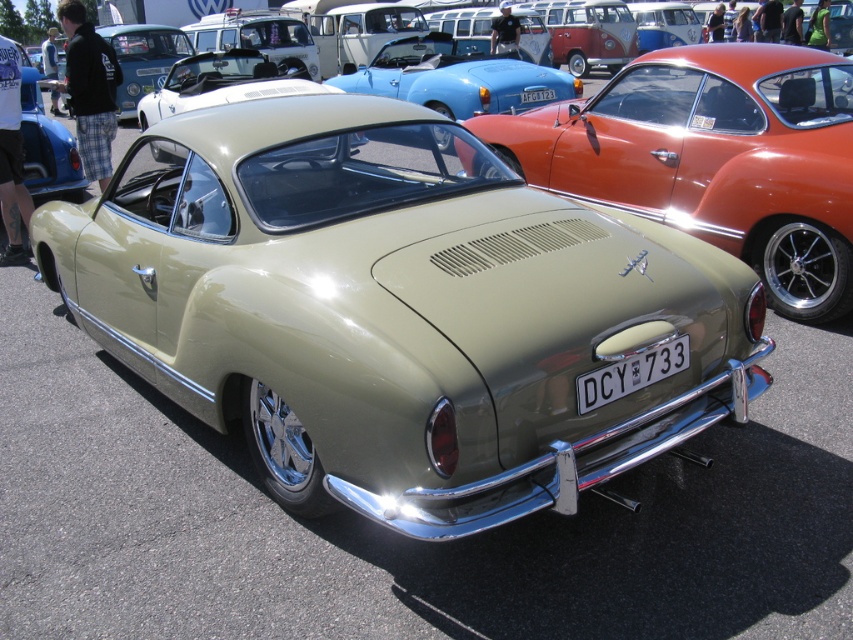
In the scene shown: Between matte green car at center and white plastic license plate at center, which one appears on the left side from the viewer's perspective?

From the viewer's perspective, white plastic license plate at center appears more on the left side.

Does point (822, 152) come behind point (553, 96)?

No, (822, 152) is in front of (553, 96).

Which is in front, point (657, 106) or point (523, 99)?

Point (657, 106) is in front.

The height and width of the screenshot is (640, 853). I want to click on matte green car at center, so click(714, 157).

Is matte green car at center below white metallic license plate at center?

Actually, matte green car at center is above white metallic license plate at center.

Is matte green car at center closer to the viewer compared to white metallic license plate at center?

No, it is not.

Identify the location of matte green car at center. (714, 157).

Which of these two, white metallic license plate at center or white plastic license plate at center, stands taller?

Standing taller between the two is white metallic license plate at center.

Which of these two, white metallic license plate at center or white plastic license plate at center, stands shorter?

With less height is white plastic license plate at center.

Does point (614, 385) come closer to viewer compared to point (535, 90)?

Yes, it is in front of point (535, 90).

You are a GUI agent. You are given a task and a screenshot of the screen. Output one action in this format:
    pyautogui.click(x=<x>, y=<y>)
    Task: Click on the white metallic license plate at center
    This screenshot has height=640, width=853.
    Given the screenshot: What is the action you would take?
    pyautogui.click(x=631, y=372)